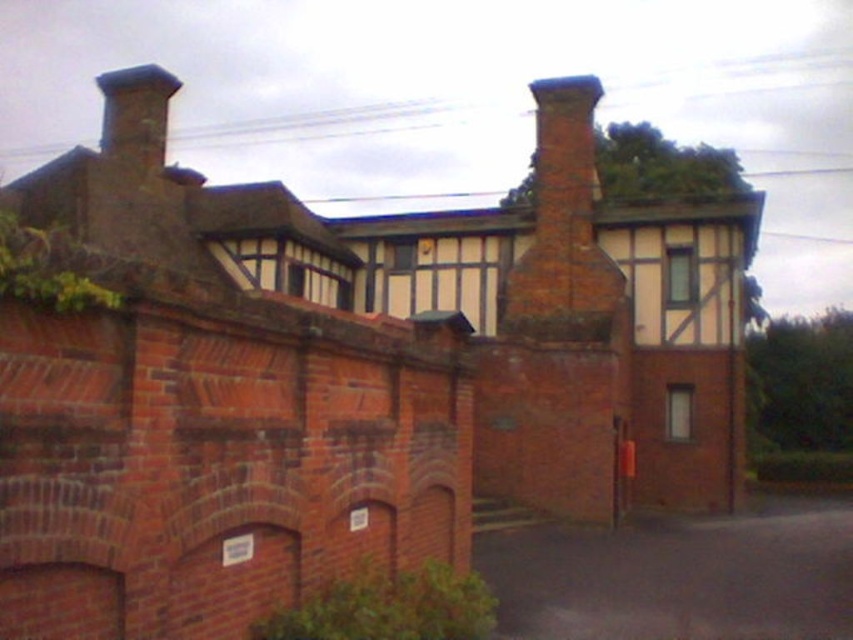
Question: Does red brick chimney at upper center lie in front of green leafy ivy at lower center?

Choices:
 (A) no
 (B) yes

Answer: (A)

Question: Considering the real-world distances, which object is closest to the green leafy ivy at lower center?

Choices:
 (A) smooth brick chimney at upper left
 (B) green leafy ivy at upper left

Answer: (B)

Question: Is red brick chimney at upper center behind green leafy ivy at upper left?

Choices:
 (A) no
 (B) yes

Answer: (B)

Question: Which point is closer to the camera?

Choices:
 (A) (376, 634)
 (B) (39, 260)

Answer: (B)

Question: Is green leafy ivy at lower center to the left of smooth brick chimney at upper left from the viewer's perspective?

Choices:
 (A) no
 (B) yes

Answer: (A)

Question: Which object is the farthest from the smooth brick chimney at upper left?

Choices:
 (A) red brick chimney at upper center
 (B) green leafy ivy at upper left
 (C) green leafy ivy at lower center

Answer: (B)